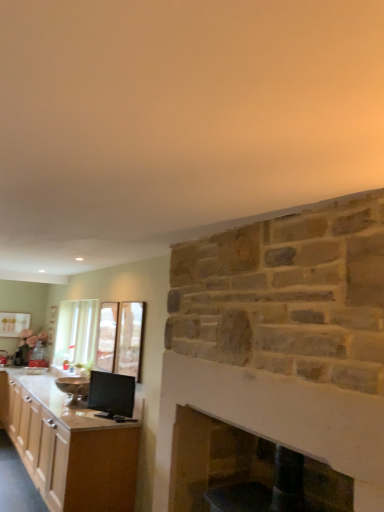
Question: Can you see smooth stone fireplace at center touching matte black monitor at lower left, positioned as the 2th appliance in left-to-right order?

Choices:
 (A) no
 (B) yes

Answer: (A)

Question: From a real-world perspective, does smooth stone fireplace at center sit lower than matte black monitor at lower left, which ranks as the 1th appliance in front-to-back order?

Choices:
 (A) yes
 (B) no

Answer: (A)

Question: Can you confirm if smooth stone fireplace at center is wider than matte black monitor at lower left, which ranks as the 1th appliance in front-to-back order?

Choices:
 (A) no
 (B) yes

Answer: (B)

Question: Is smooth stone fireplace at center further to camera compared to matte black monitor at lower left, which appears as the second appliance when viewed from the back?

Choices:
 (A) yes
 (B) no

Answer: (B)

Question: Is smooth stone fireplace at center oriented towards matte black monitor at lower left, which appears as the second appliance when viewed from the back?

Choices:
 (A) no
 (B) yes

Answer: (A)

Question: From a real-world perspective, is smooth stone fireplace at center located higher than matte black monitor at lower left, which ranks as the 1th appliance in front-to-back order?

Choices:
 (A) yes
 (B) no

Answer: (B)

Question: Could you tell me if clear glass door at center, which is the first glass door from back to front, is turned towards matte black monitor at lower left, which ranks as the 1th appliance in front-to-back order?

Choices:
 (A) yes
 (B) no

Answer: (B)

Question: Is matte black monitor at lower left, acting as the first appliance starting from the right, located within clear glass door at center, arranged as the 2th glass door when viewed from the front?

Choices:
 (A) no
 (B) yes

Answer: (A)

Question: From the image's perspective, would you say clear glass door at center, arranged as the 2th glass door when viewed from the front, is shown under matte black monitor at lower left, which ranks as the 1th appliance in front-to-back order?

Choices:
 (A) no
 (B) yes

Answer: (A)

Question: Can you confirm if clear glass door at center, the 2th glass door positioned from the right, is wider than matte black monitor at lower left, acting as the first appliance starting from the right?

Choices:
 (A) no
 (B) yes

Answer: (A)

Question: From a real-world perspective, does clear glass door at center, the 2th glass door positioned from the right, sit lower than matte black monitor at lower left, positioned as the 2th appliance in left-to-right order?

Choices:
 (A) yes
 (B) no

Answer: (B)

Question: Does clear glass door at center, which is the first glass door from left to right, have a lesser width compared to matte black monitor at lower left, which appears as the second appliance when viewed from the back?

Choices:
 (A) yes
 (B) no

Answer: (A)

Question: From a real-world perspective, is clear glass door at center, which is the first glass door from left to right, located beneath clear glass door at upper center, which appears as the first glass door when viewed from the front?

Choices:
 (A) yes
 (B) no

Answer: (B)